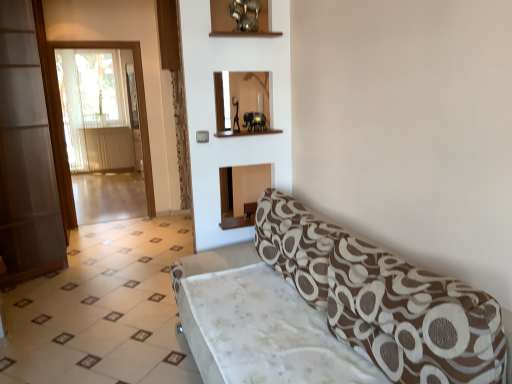
Question: Is transparent glass screen door at left, marked as the first screen door in a back-to-front arrangement, smaller than white glossy tile at lower left?

Choices:
 (A) no
 (B) yes

Answer: (B)

Question: Is transparent glass screen door at left, marked as the first screen door in a back-to-front arrangement, closer to camera compared to white glossy tile at lower left?

Choices:
 (A) yes
 (B) no

Answer: (B)

Question: From the image's perspective, is transparent glass screen door at left, marked as the first screen door in a back-to-front arrangement, on white glossy tile at lower left?

Choices:
 (A) yes
 (B) no

Answer: (A)

Question: Is white glossy tile at lower left at the back of transparent glass screen door at left, the 2th screen door in the front-to-back sequence?

Choices:
 (A) no
 (B) yes

Answer: (A)

Question: Considering the relative sizes of transparent glass screen door at left, marked as the first screen door in a back-to-front arrangement, and white glossy tile at lower left in the image provided, is transparent glass screen door at left, marked as the first screen door in a back-to-front arrangement, thinner than white glossy tile at lower left?

Choices:
 (A) yes
 (B) no

Answer: (A)

Question: Would you say white glossy tile at lower left is to the left or to the right of transparent glass screen door at left, marked as the first screen door in a back-to-front arrangement, in the picture?

Choices:
 (A) right
 (B) left

Answer: (A)

Question: Which is correct: white glossy tile at lower left is inside transparent glass screen door at left, the 2th screen door in the front-to-back sequence, or outside of it?

Choices:
 (A) outside
 (B) inside

Answer: (A)

Question: From the image's perspective, relative to transparent glass screen door at left, the 2th screen door in the front-to-back sequence, is white glossy tile at lower left above or below?

Choices:
 (A) below
 (B) above

Answer: (A)

Question: Is point (39, 314) positioned closer to the camera than point (60, 46)?

Choices:
 (A) farther
 (B) closer

Answer: (B)

Question: From a real-world perspective, is brown textured fabric studio couch at lower right above or below transparent glass screen door at left, the 2th screen door in the front-to-back sequence?

Choices:
 (A) below
 (B) above

Answer: (A)

Question: From their relative heights in the image, would you say brown textured fabric studio couch at lower right is taller or shorter than transparent glass screen door at left, marked as the first screen door in a back-to-front arrangement?

Choices:
 (A) short
 (B) tall

Answer: (A)

Question: Considering the positions of brown textured fabric studio couch at lower right and transparent glass screen door at left, the 2th screen door in the front-to-back sequence, in the image, is brown textured fabric studio couch at lower right bigger or smaller than transparent glass screen door at left, the 2th screen door in the front-to-back sequence,?

Choices:
 (A) big
 (B) small

Answer: (A)

Question: From the image's perspective, relative to transparent glass screen door at left, the 2th screen door in the front-to-back sequence, is brown textured fabric studio couch at lower right above or below?

Choices:
 (A) above
 (B) below

Answer: (B)

Question: In the image, is brown textured fabric studio couch at lower right on the left side or the right side of white glossy tile at lower left?

Choices:
 (A) left
 (B) right

Answer: (B)

Question: Based on their sizes in the image, would you say brown textured fabric studio couch at lower right is bigger or smaller than white glossy tile at lower left?

Choices:
 (A) small
 (B) big

Answer: (B)